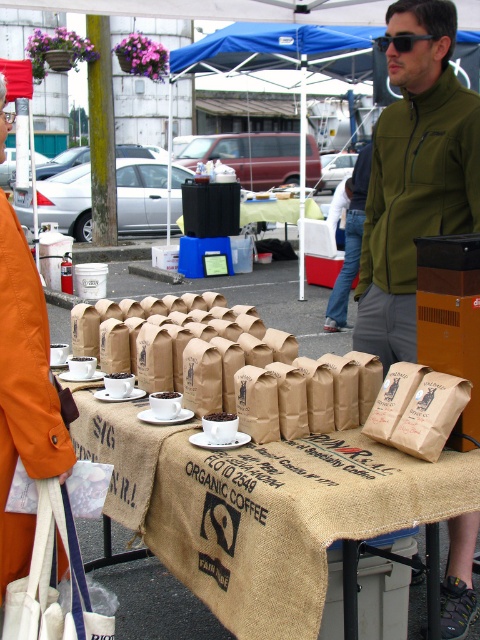
Does point (41, 392) come closer to viewer compared to point (381, 38)?

Yes, point (41, 392) is closer to viewer.

Who is more forward, (x=0, y=580) or (x=379, y=36)?

Point (x=0, y=580)

Identify the location of orange fabric bag at lower left. (24, 394).

Find the location of a particular element. The height and width of the screenshot is (640, 480). burlap tablecloth at center is located at coordinates (263, 508).

Is burlap tablecloth at center wider than brown paper bag at center?

Yes, burlap tablecloth at center is wider than brown paper bag at center.

Where is `burlap tablecloth at center`? This screenshot has height=640, width=480. burlap tablecloth at center is located at coordinates (263, 508).

Can you confirm if orange fabric bag at lower left is smaller than matte brown coffee cup at center?

Actually, orange fabric bag at lower left might be larger than matte brown coffee cup at center.

Does orange fabric bag at lower left appear on the left side of matte brown coffee cup at center?

Yes, orange fabric bag at lower left is to the left of matte brown coffee cup at center.

Locate an element on the screen. This screenshot has width=480, height=640. orange fabric bag at lower left is located at coordinates (24, 394).